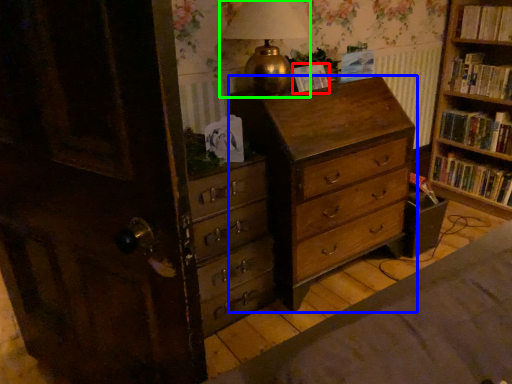
Question: Which object is positioned closest to paperback book (highlighted by a red box)? Select from chest of drawers (highlighted by a blue box) and table lamp (highlighted by a green box).

Choices:
 (A) chest of drawers
 (B) table lamp

Answer: (B)